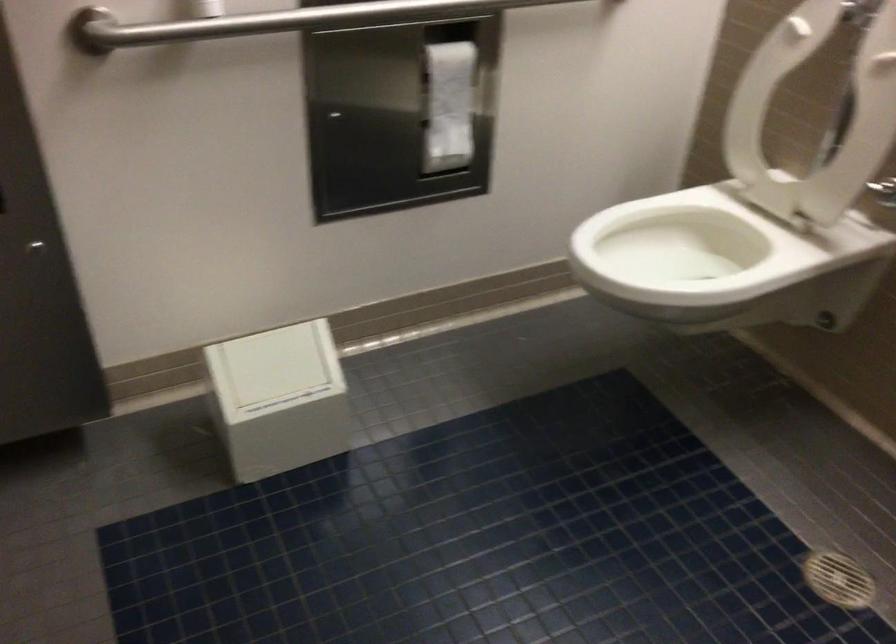
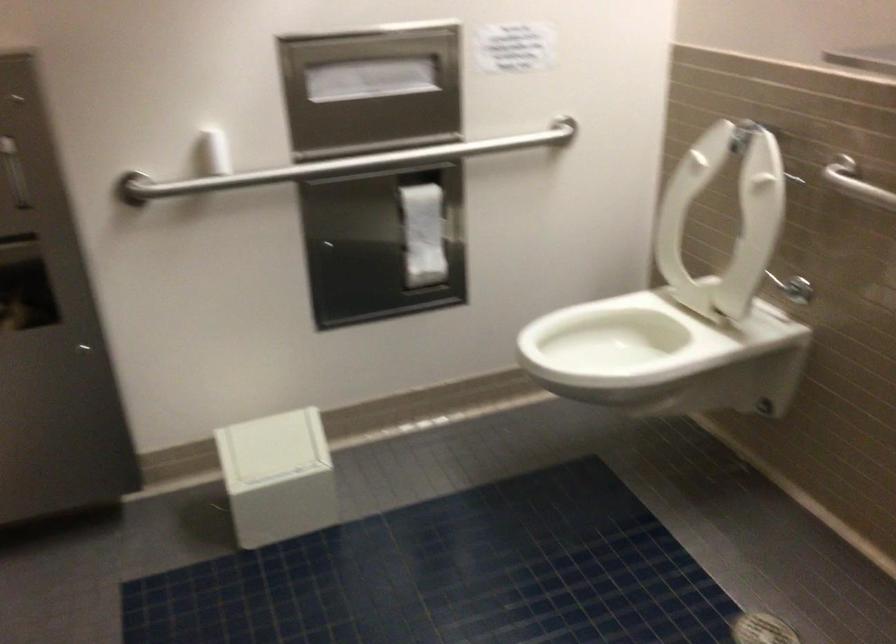
Question: Based on the continuous images, in which direction is the camera rotating? Reply with the corresponding letter.

Choices:
 (A) Left
 (B) Right
 (C) Up
 (D) Down

Answer: (C)